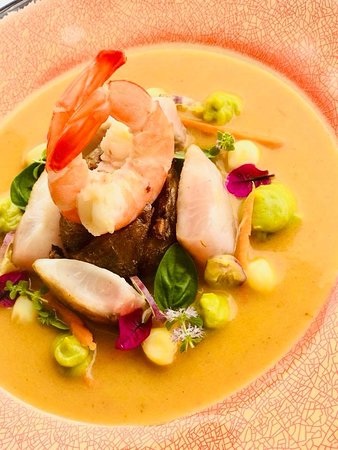
Locate an element on the screen. The height and width of the screenshot is (450, 338). bowl is located at coordinates (278, 408).